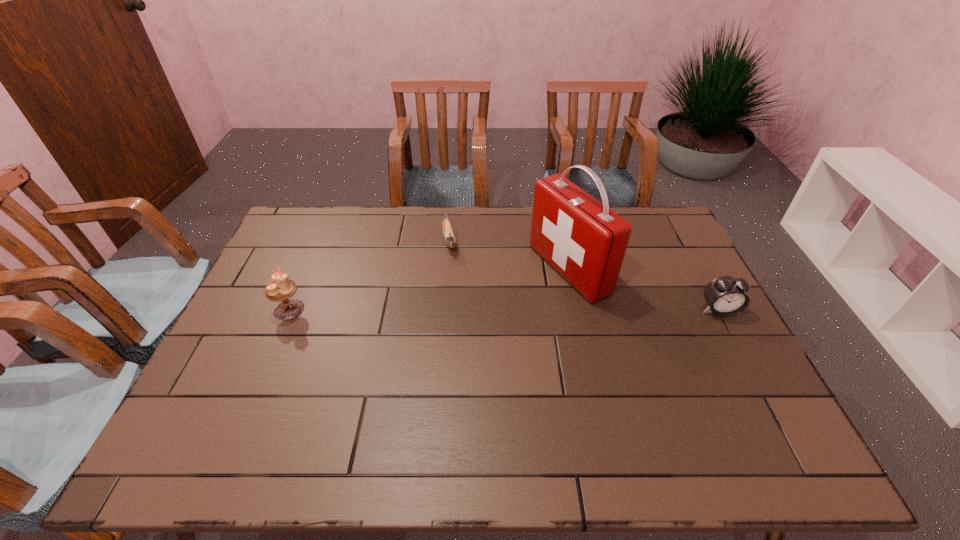
This screenshot has height=540, width=960. What are the coordinates of `free spot on the desktop that is between the leftmost object and the rightmost object and is positioned at the stem of the banana` in the screenshot? It's located at (465, 310).

Where is `free space on the desktop that is between the leftmost object and the rightmost object and is positioned on the front face of the second object from right to left`? The image size is (960, 540). free space on the desktop that is between the leftmost object and the rightmost object and is positioned on the front face of the second object from right to left is located at coordinates (475, 310).